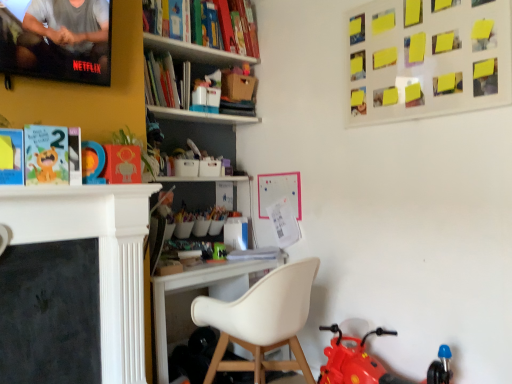
What do you see at coordinates (354, 361) in the screenshot? Image resolution: width=512 pixels, height=384 pixels. I see `rubberized red toy motorcycle at lower right, which is counted as the 3th toy, starting from the back` at bounding box center [354, 361].

Locate an element on the screen. The height and width of the screenshot is (384, 512). matte paper book at left is located at coordinates (52, 155).

In order to face matte paper book at left, should I rotate leftwards or rightwards?

To align with it, rotate left about 27.978°.

The image size is (512, 384). What do you see at coordinates (219, 251) in the screenshot?
I see `green plastic toy at center, which is the second toy in top-to-bottom order` at bounding box center [219, 251].

You are a GUI agent. You are given a task and a screenshot of the screen. Output one action in this format:
    pyautogui.click(x=<x>, y=<y>)
    Task: Click on the yellow paper at upper right
    The width and height of the screenshot is (512, 384).
    Given the screenshot: What is the action you would take?
    pyautogui.click(x=428, y=58)

In order to click on rubberized red toy motorcycle at lower right, which is counted as the 3th toy, starting from the back in this screenshot , I will do `click(354, 361)`.

Is yellow paper at upper right to the left of matte plastic number at center, which appears as the 2th toy when viewed from the front, from the viewer's perspective?

In fact, yellow paper at upper right is to the right of matte plastic number at center, which appears as the 2th toy when viewed from the front.

Does point (509, 92) appear closer or farther from the camera than point (88, 165)?

Point (509, 92) is positioned closer to the camera compared to point (88, 165).

From a real-world perspective, is yellow paper at upper right beneath matte plastic number at center, the first toy when ordered from top to bottom?

Actually, yellow paper at upper right is physically above matte plastic number at center, the first toy when ordered from top to bottom, in the real world.

From a real-world perspective, is rubberized red toy motorcycle at lower right, which is the third toy from left to right, physically below matte paper book at left?

Indeed, from a real-world perspective, rubberized red toy motorcycle at lower right, which is the third toy from left to right, is positioned beneath matte paper book at left.

In terms of height, does rubberized red toy motorcycle at lower right, which is counted as the 3th toy, starting from the back, look taller or shorter compared to matte paper book at left?

Clearly, rubberized red toy motorcycle at lower right, which is counted as the 3th toy, starting from the back, is taller compared to matte paper book at left.

What's the angular difference between rubberized red toy motorcycle at lower right, which is the 1th toy from right to left, and matte paper book at left's facing directions?

The angular difference between rubberized red toy motorcycle at lower right, which is the 1th toy from right to left, and matte paper book at left is 90 degrees.

Is white matte chair at center touching matte plastic number at center, the third toy positioned from the right?

No, white matte chair at center is not touching matte plastic number at center, the third toy positioned from the right.

Based on the photo, is white matte chair at center aimed at matte plastic number at center, placed as the 3th toy when sorted from bottom to top?

No.

Does white matte chair at center have a larger size compared to matte plastic number at center, the second toy when ordered from back to front?

Yes.

Is matte plastic number at center, the third toy positioned from the right, inside white matte chair at center?

No, white matte chair at center does not contain matte plastic number at center, the third toy positioned from the right.

From the image's perspective, is matte plastic number at center, which appears as the 1th toy when viewed from the left, located above matte paper book at left?

No, from the image's perspective, matte plastic number at center, which appears as the 1th toy when viewed from the left, is not above matte paper book at left.

Is matte plastic number at center, the second toy when ordered from back to front, facing away from matte paper book at left?

No, matte paper book at left is not at the back of matte plastic number at center, the second toy when ordered from back to front.

Is matte plastic number at center, the second toy when ordered from back to front, wider than matte paper book at left?

In fact, matte plastic number at center, the second toy when ordered from back to front, might be narrower than matte paper book at left.

How much distance is there between matte plastic number at center, which appears as the 1th toy when viewed from the left, and matte paper book at left?

They are 3.80 inches apart.

Is matte plastic number at center, which appears as the 1th toy when viewed from the left, bigger or smaller than rubberized red toy motorcycle at lower right, which is counted as the first toy, starting from the front?

In the image, matte plastic number at center, which appears as the 1th toy when viewed from the left, appears to be smaller than rubberized red toy motorcycle at lower right, which is counted as the first toy, starting from the front.

In terms of height, does matte plastic number at center, the second toy when ordered from back to front, look taller or shorter compared to rubberized red toy motorcycle at lower right, which is the third toy from left to right?

matte plastic number at center, the second toy when ordered from back to front, is shorter than rubberized red toy motorcycle at lower right, which is the third toy from left to right.

Is matte plastic number at center, which appears as the 2th toy when viewed from the front, far from rubberized red toy motorcycle at lower right, which is the third toy from left to right?

Yes.

What's the angular difference between matte plastic number at center, placed as the 3th toy when sorted from bottom to top, and rubberized red toy motorcycle at lower right, which is the 1th toy from right to left,'s facing directions?

90 degrees.

Does matte plastic number at center, which appears as the 2th toy when viewed from the front, have a smaller size compared to green plastic toy at center, the first toy in the back-to-front sequence?

Yes.

Is point (84, 180) farther from viewer compared to point (214, 254)?

No, (84, 180) is in front of (214, 254).

Is matte plastic number at center, placed as the 3th toy when sorted from bottom to top, aimed at green plastic toy at center, marked as the 2th toy in a bottom-to-top arrangement?

No.

From the picture: From a real-world perspective, which is physically above, matte plastic number at center, the third toy positioned from the right, or green plastic toy at center, which is the second toy in top-to-bottom order?

From a 3D spatial view, matte plastic number at center, the third toy positioned from the right, is above.

Is yellow paper at upper right positioned with its back to white matte chair at center?

No.

What's the angular difference between yellow paper at upper right and white matte chair at center's facing directions?

The facing directions of yellow paper at upper right and white matte chair at center are 90 degrees apart.

Consider the image. From a real-world perspective, which is physically above, yellow paper at upper right or white matte chair at center?

yellow paper at upper right, from a real-world perspective.

Considering their positions, is yellow paper at upper right located in front of or behind white matte chair at center?

yellow paper at upper right is in front of white matte chair at center.

The width and height of the screenshot is (512, 384). Find the location of `bulletin board to the right of matte plastic number at center, the second toy when ordered from back to front`. bulletin board to the right of matte plastic number at center, the second toy when ordered from back to front is located at coordinates (428, 58).

Locate an element on the screen. The width and height of the screenshot is (512, 384). book on the left of the rubberized red toy motorcycle at lower right, which is counted as the first toy, starting from the front is located at coordinates (52, 155).

From the image, which object appears to be nearer to white matte chair at center, green plastic toy at center, marked as the 2th toy in a bottom-to-top arrangement, or matte plastic number at center, which appears as the 1th toy when viewed from the left?

The object closer to white matte chair at center is green plastic toy at center, marked as the 2th toy in a bottom-to-top arrangement.

Looking at the image, which one is located closer to rubberized red toy motorcycle at lower right, which is counted as the first toy, starting from the front, yellow paper at upper right or matte plastic number at center, which appears as the 1th toy when viewed from the left?

yellow paper at upper right is closer to rubberized red toy motorcycle at lower right, which is counted as the first toy, starting from the front.

Estimate the real-world distances between objects in this image. Which object is further from green plastic toy at center, which appears as the 2th toy when viewed from the left, matte plastic number at center, which appears as the 1th toy when viewed from the left, or yellow paper at upper right?

yellow paper at upper right.

In the scene shown: Based on their spatial positions, is green plastic toy at center, marked as the 2th toy in a bottom-to-top arrangement, or matte paper book at left closer to white matte chair at center?

Based on the image, green plastic toy at center, marked as the 2th toy in a bottom-to-top arrangement, appears to be nearer to white matte chair at center.

When comparing their distances from matte paper book at left, does yellow paper at upper right or rubberized red toy motorcycle at lower right, which is the 1th toy from right to left, seem further?

Among the two, rubberized red toy motorcycle at lower right, which is the 1th toy from right to left, is located further to matte paper book at left.

When comparing their distances from white matte chair at center, does matte paper book at left or rubberized red toy motorcycle at lower right, which is the 1th toy from right to left, seem further?

The object further to white matte chair at center is matte paper book at left.

Based on their spatial positions, is green plastic toy at center, marked as the 2th toy in a bottom-to-top arrangement, or matte plastic number at center, which appears as the 1th toy when viewed from the left, further from rubberized red toy motorcycle at lower right, which is the third toy from left to right?

The object further to rubberized red toy motorcycle at lower right, which is the third toy from left to right, is matte plastic number at center, which appears as the 1th toy when viewed from the left.

When comparing their distances from yellow paper at upper right, does matte plastic number at center, the first toy when ordered from top to bottom, or white matte chair at center seem further?

Based on the image, matte plastic number at center, the first toy when ordered from top to bottom, appears to be further to yellow paper at upper right.

Identify the location of toy situated between matte plastic number at center, which appears as the 2th toy when viewed from the front, and rubberized red toy motorcycle at lower right, which is the first toy in bottom-to-top order, from left to right. The image size is (512, 384). (219, 251).

Where is `chair between matte plastic number at center, the first toy when ordered from top to bottom, and rubberized red toy motorcycle at lower right, arranged as the 3th toy when viewed from the top, from left to right`? The image size is (512, 384). chair between matte plastic number at center, the first toy when ordered from top to bottom, and rubberized red toy motorcycle at lower right, arranged as the 3th toy when viewed from the top, from left to right is located at coordinates (262, 321).

At what (x,y) coordinates should I click in order to perform the action: click on chair located between matte paper book at left and green plastic toy at center, marked as the 3th toy in a front-to-back arrangement, in the depth direction. Please return your answer as a coordinate pair (x, y). This screenshot has height=384, width=512. Looking at the image, I should click on (262, 321).

I want to click on chair between rubberized red toy motorcycle at lower right, which is counted as the first toy, starting from the front, and green plastic toy at center, which ranks as the second toy in right-to-left order, along the z-axis, so click(x=262, y=321).